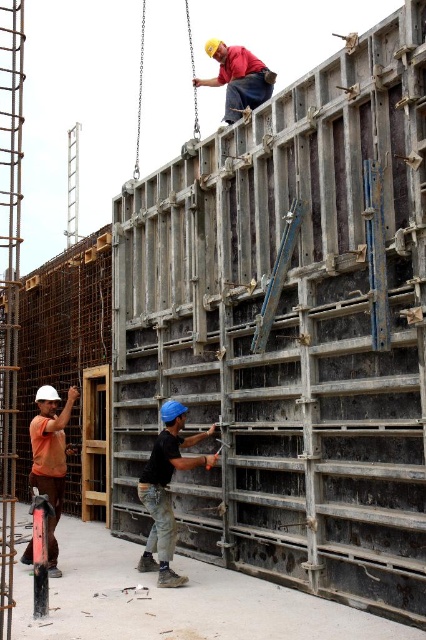
Question: Does black matte construction worker at center appear over matte black shirt at upper center?

Choices:
 (A) no
 (B) yes

Answer: (A)

Question: Considering the relative positions of black matte construction worker at center and matte black shirt at upper center in the image provided, where is black matte construction worker at center located with respect to matte black shirt at upper center?

Choices:
 (A) left
 (B) right

Answer: (A)

Question: Which point is farther from the camera taking this photo?

Choices:
 (A) (37, 486)
 (B) (192, 80)
 (C) (192, 440)

Answer: (B)

Question: Can you confirm if black matte construction worker at center is positioned below matte black shirt at upper center?

Choices:
 (A) yes
 (B) no

Answer: (A)

Question: Which of the following is the farthest from the observer?

Choices:
 (A) matte black shirt at upper center
 (B) black matte construction worker at center
 (C) orange matte shirt at lower left

Answer: (A)

Question: Which object is closer to the camera taking this photo?

Choices:
 (A) orange matte shirt at lower left
 (B) black matte construction worker at center

Answer: (A)